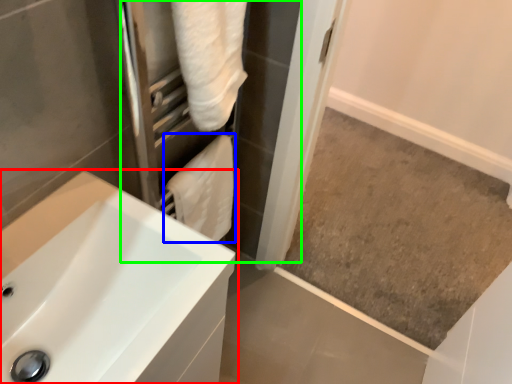
Question: Estimate the real-world distances between objects in this image. Which object is farther from sink (highlighted by a red box), bath towel (highlighted by a blue box) or screen door (highlighted by a green box)?

Choices:
 (A) bath towel
 (B) screen door

Answer: (B)